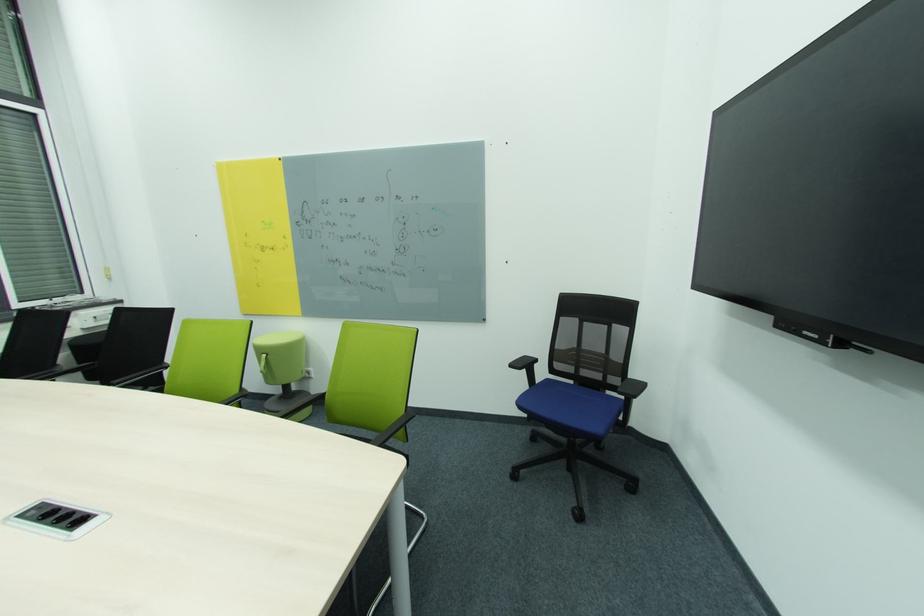
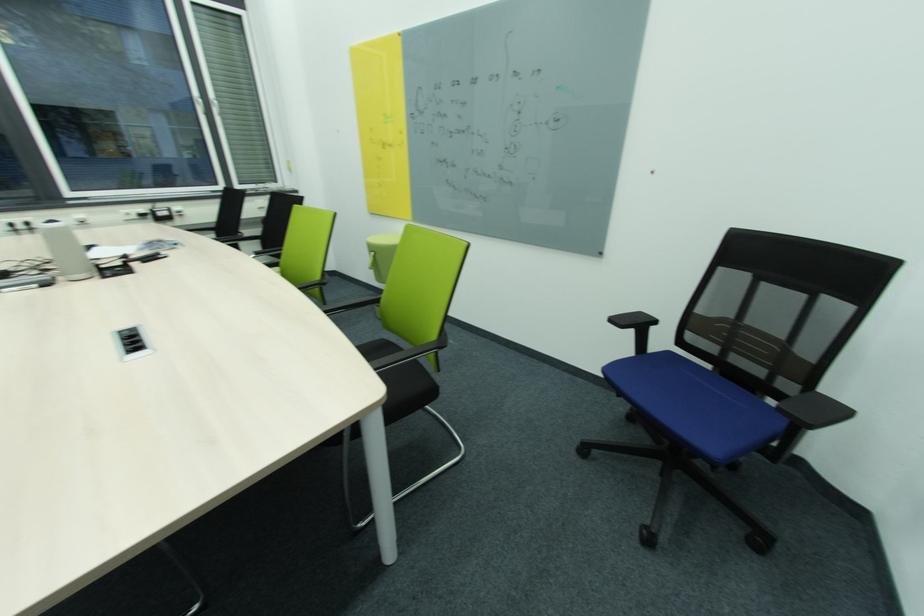
In the second image, find the point that corresponds to pixel 647 387 in the first image.

(845, 411)